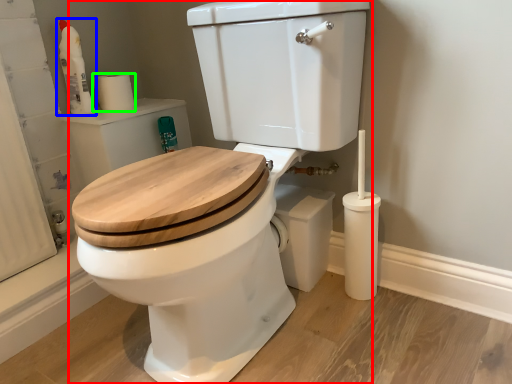
Question: Which object is positioned closest to toilet (highlighted by a red box)? Select from cleaning product (highlighted by a blue box) and toilet paper (highlighted by a green box).

Choices:
 (A) cleaning product
 (B) toilet paper

Answer: (B)